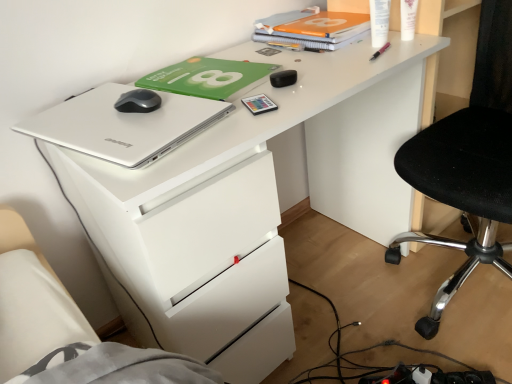
This screenshot has width=512, height=384. I want to click on free space between green matte paperback book at upper center and white plastic bottle at upper right, which is the fourth stationery from left to right, so click(x=302, y=59).